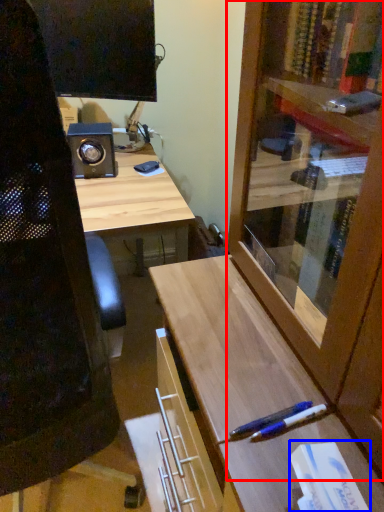
Question: Which of the following is the farthest to the observer, cabinetry (highlighted by a red box) or book (highlighted by a blue box)?

Choices:
 (A) cabinetry
 (B) book

Answer: (B)